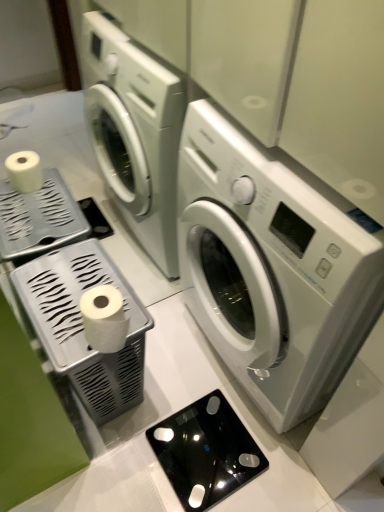
Question: From a real-world perspective, is white glossy washing machine at center physically located above or below white plastic tissue holder at left, which is the 2th appliance from right to left?

Choices:
 (A) below
 (B) above

Answer: (B)

Question: Is white glossy washing machine at center bigger or smaller than white plastic tissue holder at left, which is the 2th appliance from right to left?

Choices:
 (A) big
 (B) small

Answer: (A)

Question: Estimate the real-world distances between objects in this image. Which object is closer to the white glossy washing machine at center?

Choices:
 (A) black glass scale at lower center, the 1th appliance in the right-to-left sequence
 (B) white glossy toilet paper at lower left
 (C) white plastic tissue holder at left, arranged as the 1th appliance when viewed from the left

Answer: (C)

Question: Considering the real-world distances, which object is closest to the black glass scale at lower center, placed as the 2th appliance when sorted from left to right?

Choices:
 (A) white plastic tissue holder at left, which is the 2th appliance from right to left
 (B) white glossy toilet paper at lower left
 (C) white glossy washing machine at center

Answer: (A)